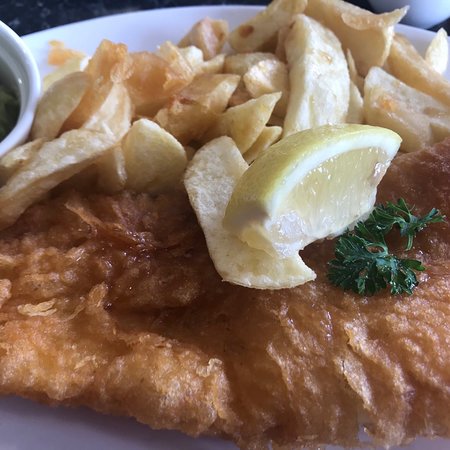
This screenshot has width=450, height=450. Identify the location of white bowl. (422, 7).